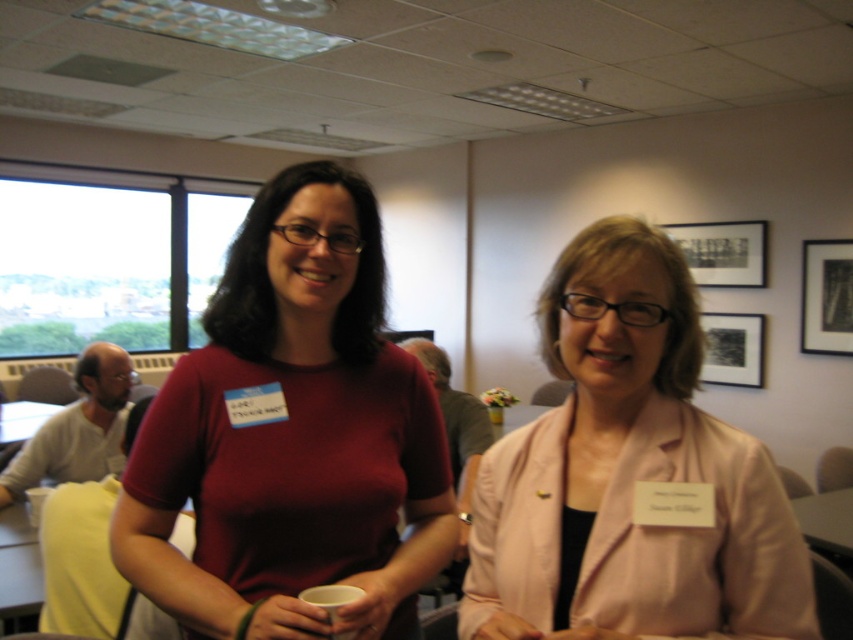
Question: Among these objects, which one is farthest from the camera?

Choices:
 (A) pink fabric jacket at center
 (B) matte red shirt at center

Answer: (B)

Question: Does matte red shirt at center appear on the right side of pink fabric jacket at center?

Choices:
 (A) no
 (B) yes

Answer: (A)

Question: Is matte red shirt at center bigger than pink fabric jacket at center?

Choices:
 (A) no
 (B) yes

Answer: (B)

Question: Which object appears closest to the camera in this image?

Choices:
 (A) pink fabric jacket at center
 (B) matte red shirt at center

Answer: (A)

Question: Among these objects, which one is nearest to the camera?

Choices:
 (A) matte red shirt at center
 (B) pink fabric jacket at center

Answer: (B)

Question: Is matte red shirt at center closer to the viewer compared to pink fabric jacket at center?

Choices:
 (A) no
 (B) yes

Answer: (A)